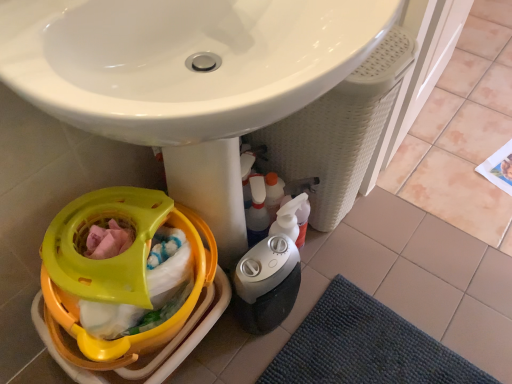
You are a GUI agent. You are given a task and a screenshot of the screen. Output one action in this format:
    pyautogui.click(x=<x>, y=<y>)
    Task: Click on the free space behind dark blue textured bath mat at lower right
    This screenshot has width=512, height=384.
    Given the screenshot: What is the action you would take?
    coord(402,260)